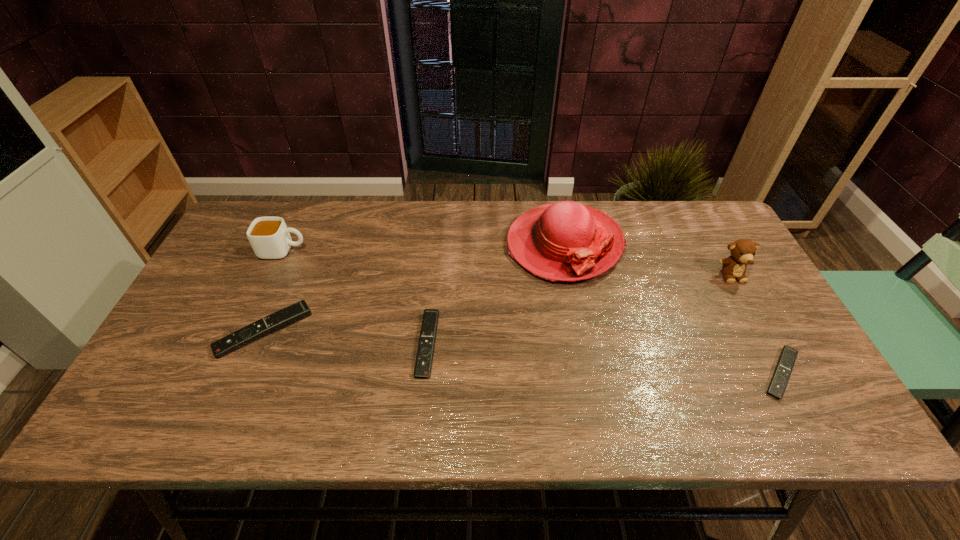
Locate an element on the screen. This screenshot has height=540, width=960. free space that is in between the third object from right to left and the second tallest remote control is located at coordinates click(x=495, y=294).

Find the location of `free space that is in between the third tallest object and the leftmost remote control`. free space that is in between the third tallest object and the leftmost remote control is located at coordinates (274, 291).

This screenshot has width=960, height=540. Identify the location of vacant space that is in between the tallest object and the fourth tallest object. (414, 287).

Where is `free point between the fifth shortest object and the third object from right to left`? The height and width of the screenshot is (540, 960). free point between the fifth shortest object and the third object from right to left is located at coordinates (648, 259).

The width and height of the screenshot is (960, 540). Identify the location of vacant region between the second remote control from right to left and the tallest object. (495, 294).

I want to click on free area in between the third shortest object and the cup, so click(274, 291).

You are a GUI agent. You are given a task and a screenshot of the screen. Output one action in this format:
    pyautogui.click(x=<x>, y=<y>)
    Task: Click on the free space between the rightmost remote control and the hat
    
    Given the screenshot: What is the action you would take?
    pyautogui.click(x=672, y=309)

Find the location of a particular element. Image resolution: width=960 pixels, height=540 pixels. vacant point located between the third object from left to right and the teddy bear is located at coordinates (580, 309).

Identify the location of free space that is in between the third object from right to left and the rightmost remote control. (672, 309).

Where is `the third closest object relative to the shortest remote control`? the third closest object relative to the shortest remote control is located at coordinates (423, 364).